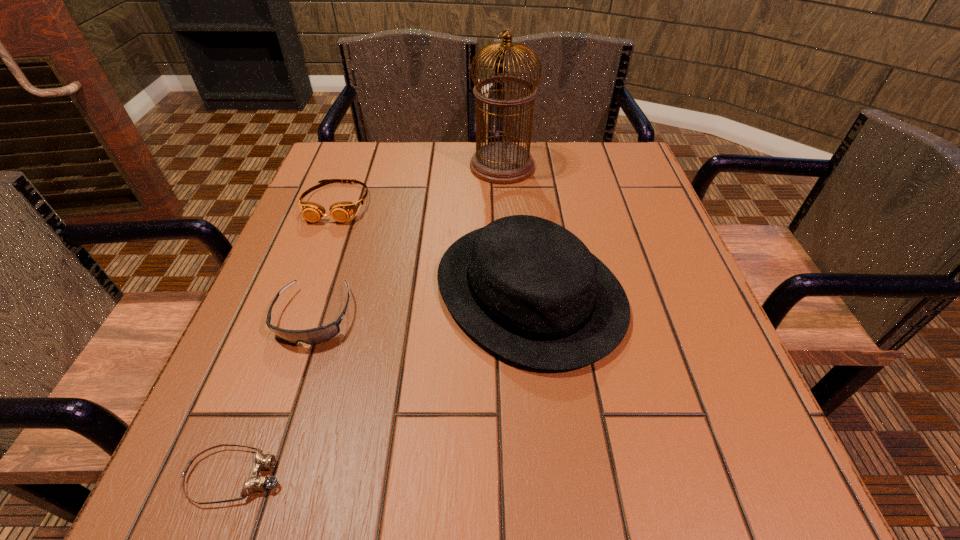
In order to click on blank space at the near edge of the desktop in this screenshot , I will do tap(377, 470).

Locate an element on the screen. This screenshot has width=960, height=540. free location at the left edge is located at coordinates (328, 211).

Where is `free space at the right edge of the desktop`? This screenshot has width=960, height=540. free space at the right edge of the desktop is located at coordinates (592, 207).

Where is `blank space at the far right corner of the desktop`? The width and height of the screenshot is (960, 540). blank space at the far right corner of the desktop is located at coordinates (625, 191).

At what (x,y) coordinates should I click in order to perform the action: click on free spot between the farthest goggles and the fourth shortest object. Please return your answer as a coordinate pair (x, y). Looking at the image, I should click on (433, 247).

Where is `free space between the second farthest goggles and the farthest goggles`? free space between the second farthest goggles and the farthest goggles is located at coordinates tap(325, 260).

You are a GUI agent. You are given a task and a screenshot of the screen. Output one action in this format:
    pyautogui.click(x=<x>, y=<y>)
    Task: Click on the vacant point located between the fourth shortest object and the second farthest goggles
    This screenshot has height=540, width=960.
    Given the screenshot: What is the action you would take?
    pyautogui.click(x=421, y=304)

Locate an element on the screen. empty space between the birdcage and the nearest goggles is located at coordinates (369, 321).

I want to click on vacant area that lies between the fourth shortest object and the second nearest goggles, so click(x=421, y=304).

Identify which object is located as the second nearest to the shortest object. Please provide its 2D coordinates. Your answer should be formatted as a tuple, i.e. [(x, y)], where the tuple contains the x and y coordinates of a point satisfying the conditions above.

[(529, 290)]